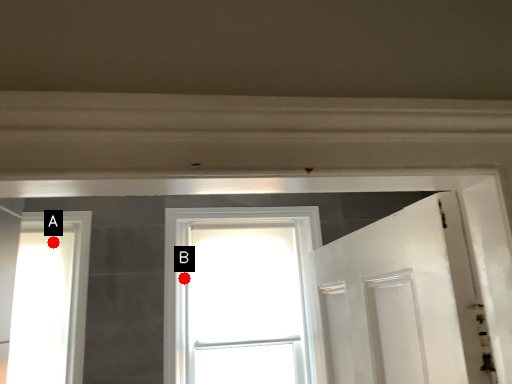
Question: Two points are circled on the image, labeled by A and B beside each circle. Which point is closer to the camera?

Choices:
 (A) A is closer
 (B) B is closer

Answer: (A)